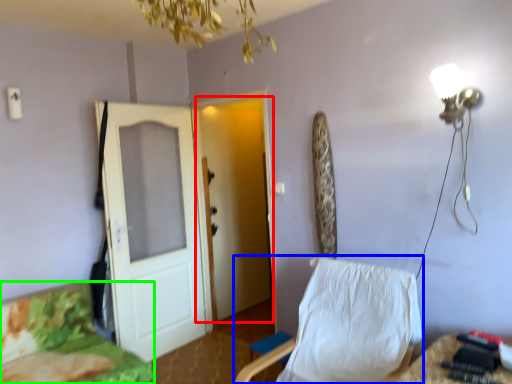
Question: Which object is positioned farthest from door (highlighted by a red box)? Select from chair (highlighted by a blue box) and furniture (highlighted by a green box).

Choices:
 (A) chair
 (B) furniture

Answer: (A)